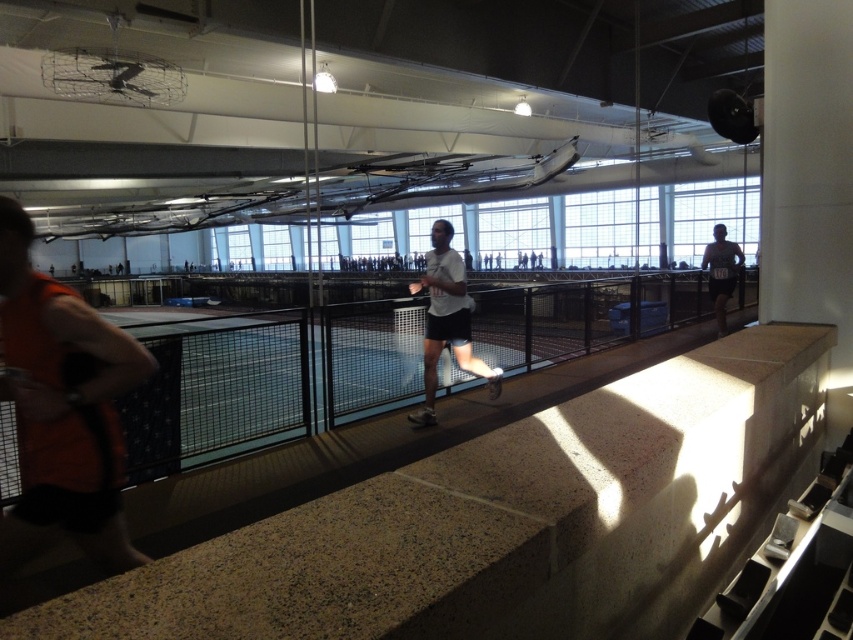
Question: Which point appears farthest from the camera in this image?

Choices:
 (A) (590, 529)
 (B) (74, 531)
 (C) (482, 372)

Answer: (C)

Question: Based on their relative distances, which object is farther from the white matte shorts at center?

Choices:
 (A) orange fabric shirt at left
 (B) matte black shorts at right
 (C) speckled concrete ledge at center

Answer: (B)

Question: Is speckled concrete ledge at center bigger than orange fabric shirt at left?

Choices:
 (A) yes
 (B) no

Answer: (A)

Question: Which object is positioned closest to the white matte shorts at center?

Choices:
 (A) speckled concrete ledge at center
 (B) matte black shorts at right
 (C) orange fabric shirt at left

Answer: (A)

Question: Is speckled concrete ledge at center positioned before matte black shorts at right?

Choices:
 (A) yes
 (B) no

Answer: (A)

Question: Observing the image, what is the correct spatial positioning of speckled concrete ledge at center in reference to matte black shorts at right?

Choices:
 (A) below
 (B) above

Answer: (A)